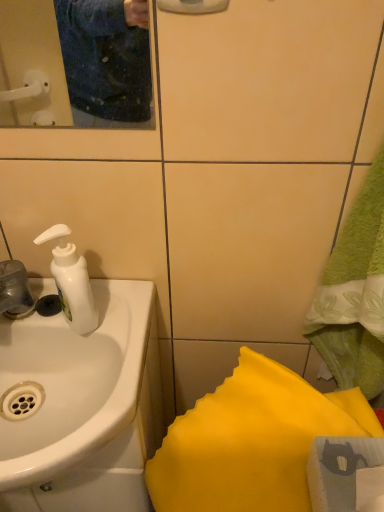
Question: Are matte plastic mirror at upper left and white glossy sink at left beside each other?

Choices:
 (A) yes
 (B) no

Answer: (B)

Question: Is white glossy sink at left located within matte plastic mirror at upper left?

Choices:
 (A) yes
 (B) no

Answer: (B)

Question: Is matte plastic mirror at upper left wider than white glossy sink at left?

Choices:
 (A) yes
 (B) no

Answer: (B)

Question: Is matte plastic mirror at upper left to the left of white glossy sink at left from the viewer's perspective?

Choices:
 (A) no
 (B) yes

Answer: (B)

Question: Is matte plastic mirror at upper left not within white glossy sink at left?

Choices:
 (A) no
 (B) yes

Answer: (B)

Question: From a real-world perspective, is matte plastic mirror at upper left located higher than white glossy sink at left?

Choices:
 (A) yes
 (B) no

Answer: (A)

Question: Is white glossy sink at left closer to the viewer compared to yellow fabric at lower right?

Choices:
 (A) no
 (B) yes

Answer: (A)

Question: Considering the relative sizes of white glossy sink at left and yellow fabric at lower right in the image provided, is white glossy sink at left thinner than yellow fabric at lower right?

Choices:
 (A) no
 (B) yes

Answer: (A)

Question: Considering the relative sizes of white glossy sink at left and yellow fabric at lower right in the image provided, is white glossy sink at left bigger than yellow fabric at lower right?

Choices:
 (A) yes
 (B) no

Answer: (A)

Question: Is white glossy sink at left shorter than yellow fabric at lower right?

Choices:
 (A) yes
 (B) no

Answer: (A)

Question: Is white glossy sink at left in contact with yellow fabric at lower right?

Choices:
 (A) yes
 (B) no

Answer: (B)

Question: From a real-world perspective, is white glossy sink at left on yellow fabric at lower right?

Choices:
 (A) yes
 (B) no

Answer: (A)

Question: From the image's perspective, does yellow fabric at lower right appear lower than white glossy sink at left?

Choices:
 (A) yes
 (B) no

Answer: (A)